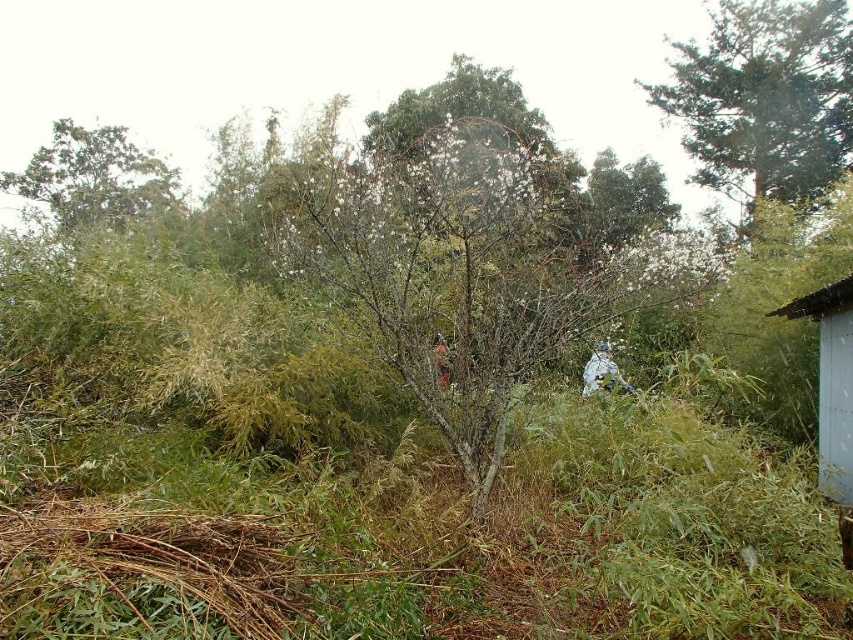
You are standing in the outdoor area and want to take a photo of the white matte person at center. The green leafy tree at upper left is blocking your view. Can you move to the right to get a clear shot without the tree in the frame?

The green leafy tree at upper left is taller than the white matte person at center, so moving to the right may not fully eliminate the tree from the frame since it is taller and could still appear in the background.

You are standing in the outdoor scene and want to take a photo of the green leafy tree at upper left. Considering the position of the tree, where should you aim your camera to capture it in the frame?

The green leafy tree at upper left is located at point (94, 177), so you should aim your camera towards the upper left area of the scene to capture it in the frame.